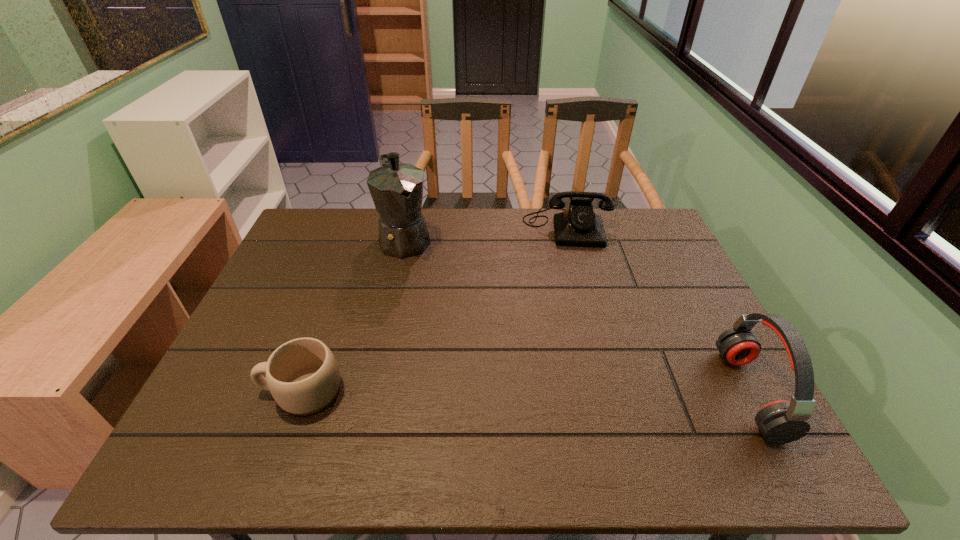
This screenshot has width=960, height=540. I want to click on free location located 0.160m on the pouring side of the coffeepot, so click(429, 296).

Locate an element on the screen. telephone at the far edge is located at coordinates (578, 225).

Where is `coffeepot that is at the far edge`? Image resolution: width=960 pixels, height=540 pixels. coffeepot that is at the far edge is located at coordinates tap(397, 189).

Where is `mug that is at the near edge`? Image resolution: width=960 pixels, height=540 pixels. mug that is at the near edge is located at coordinates (302, 375).

The height and width of the screenshot is (540, 960). Find the location of `earphone positioned at the near edge`. earphone positioned at the near edge is located at coordinates (782, 421).

At what (x,y) coordinates should I click in order to perform the action: click on object that is at the left edge. Please return your answer as a coordinate pair (x, y). The image size is (960, 540). Looking at the image, I should click on (302, 375).

The image size is (960, 540). I want to click on object at the right edge, so click(x=782, y=421).

Where is `object located at the near left corner`? The image size is (960, 540). object located at the near left corner is located at coordinates (302, 375).

You are a GUI agent. You are given a task and a screenshot of the screen. Output one action in this format:
    pyautogui.click(x=<x>, y=<y>)
    Task: Click on the object situated at the near right corner
    The height and width of the screenshot is (540, 960).
    Given the screenshot: What is the action you would take?
    pyautogui.click(x=782, y=421)

Find the location of a particular element. This screenshot has width=960, height=540. free region at the far edge of the desktop is located at coordinates (432, 230).